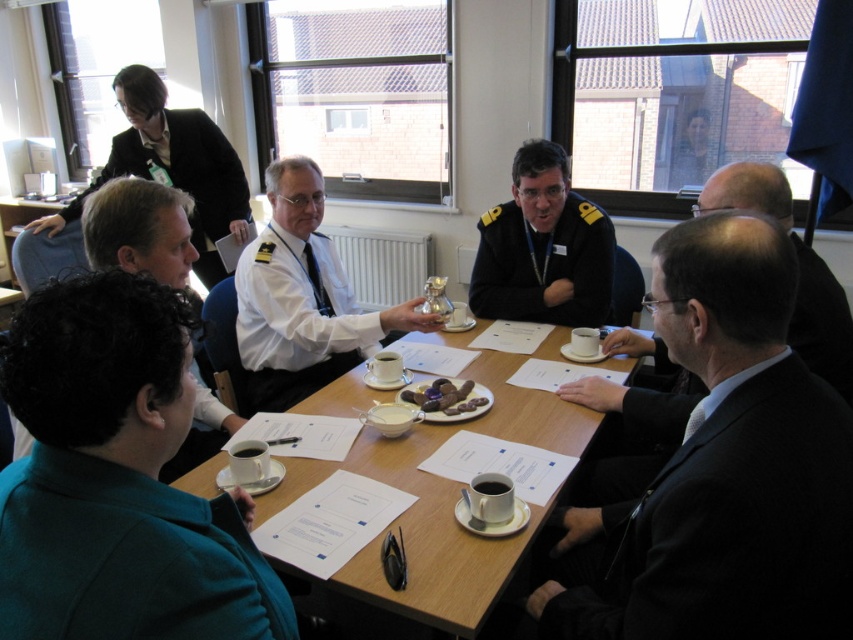
Does point (90, 220) come closer to viewer compared to point (450, 380)?

Yes.

At what (x,y) coordinates should I click in order to perform the action: click on white uniform at upper center. Please return your answer as a coordinate pair (x, y). Looking at the image, I should click on (140, 230).

Does wooden table at center appear under dark blue uniform at center?

Yes.

Between wooden table at center and dark blue uniform at center, which one has more height?

Standing taller between the two is dark blue uniform at center.

Is point (393, 600) behind point (537, 205)?

No, (393, 600) is in front of (537, 205).

I want to click on wooden table at center, so click(x=434, y=515).

Which is more to the right, wooden table at center or white uniform at upper center?

From the viewer's perspective, wooden table at center appears more on the right side.

Between point (512, 387) and point (132, 179), which one is positioned in front?

Point (132, 179)

Identify the location of wooden table at center. (434, 515).